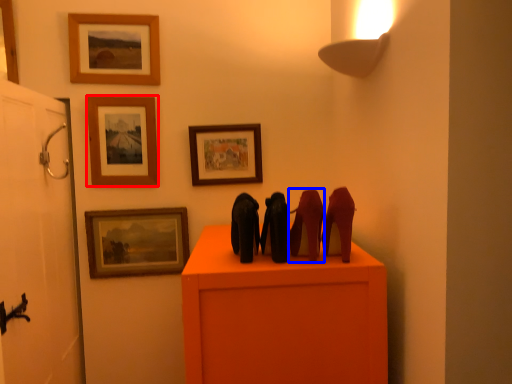
Question: Among these objects, which one is farthest to the camera, picture frame (highlighted by a red box) or animal (highlighted by a blue box)?

Choices:
 (A) picture frame
 (B) animal

Answer: (A)